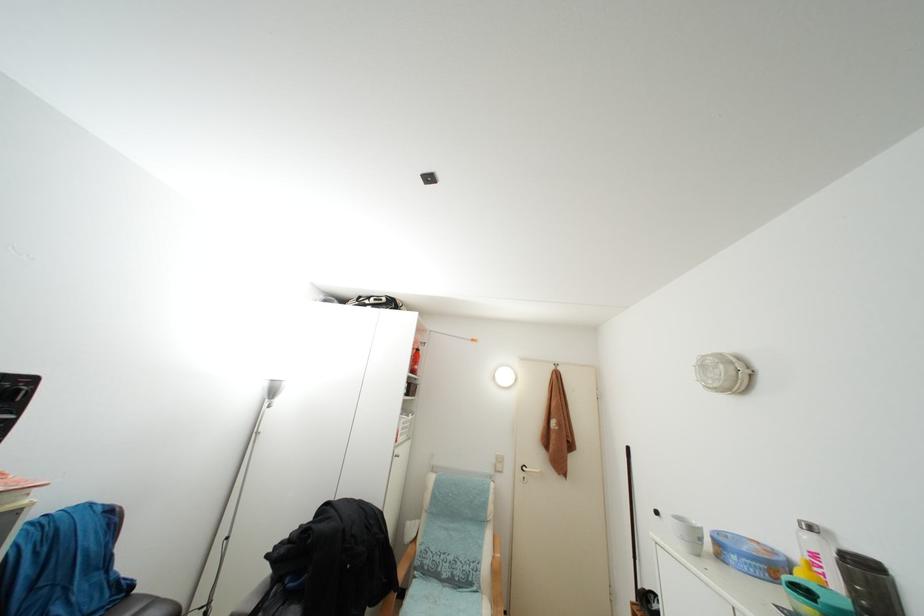
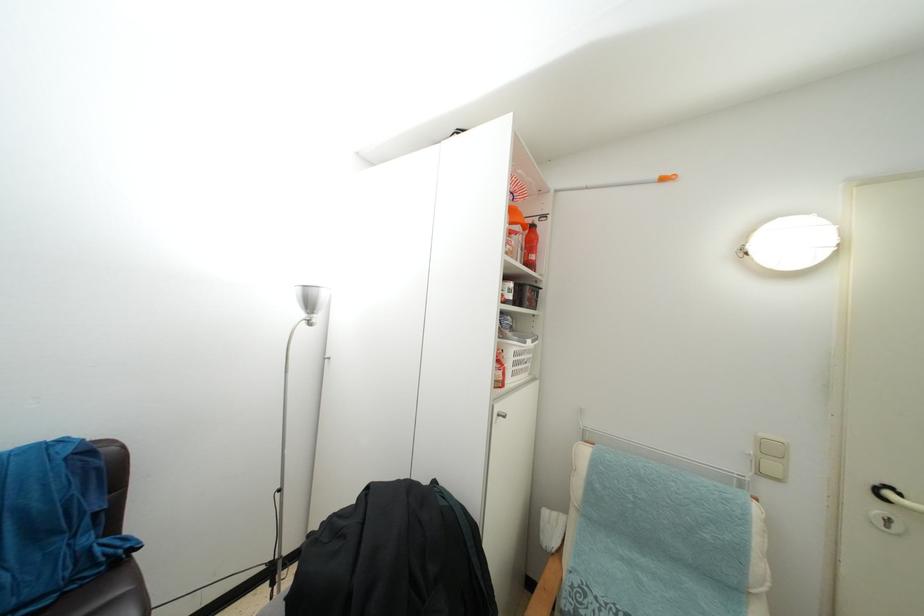
The point at (407, 435) is marked in the first image. Where is the corresponding point in the second image?

(519, 370)